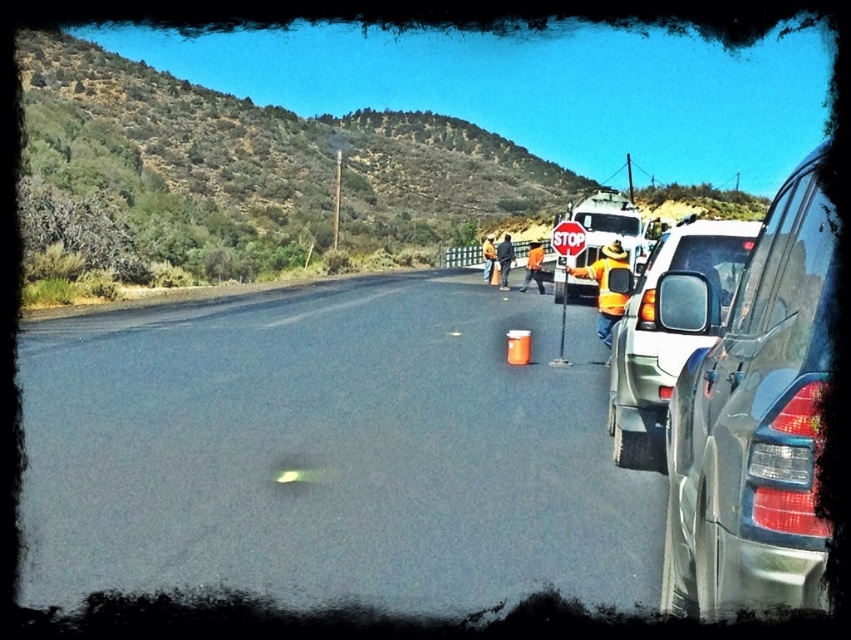
You are driving a car and see the satin silver sedan at right parked on the side of the black asphalt road at center. Based on the scene, which side of the road is the sedan parked on?

The satin silver sedan at right is parked on the right side of the black asphalt road at center because the black asphalt road at center is to the left of the sedan.

You are driving a car and see two points on the road ahead. The first point is at coordinate point [338,552] and the second point is at coordinate point [626,385]. Which point is closer to your current position?

Point [338,552] is closer to the viewer than point [626,385], so the first point is closer to your current position.